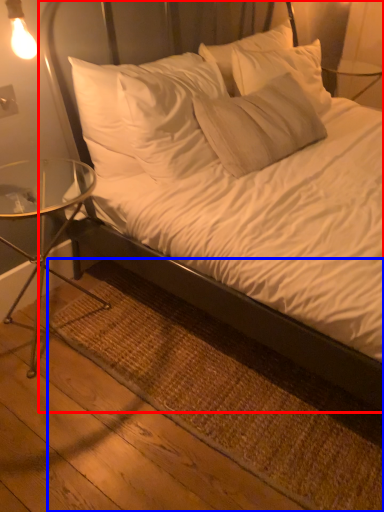
Question: Among these objects, which one is nearest to the camera, bed (highlighted by a red box) or mat (highlighted by a blue box)?

Choices:
 (A) bed
 (B) mat

Answer: (A)